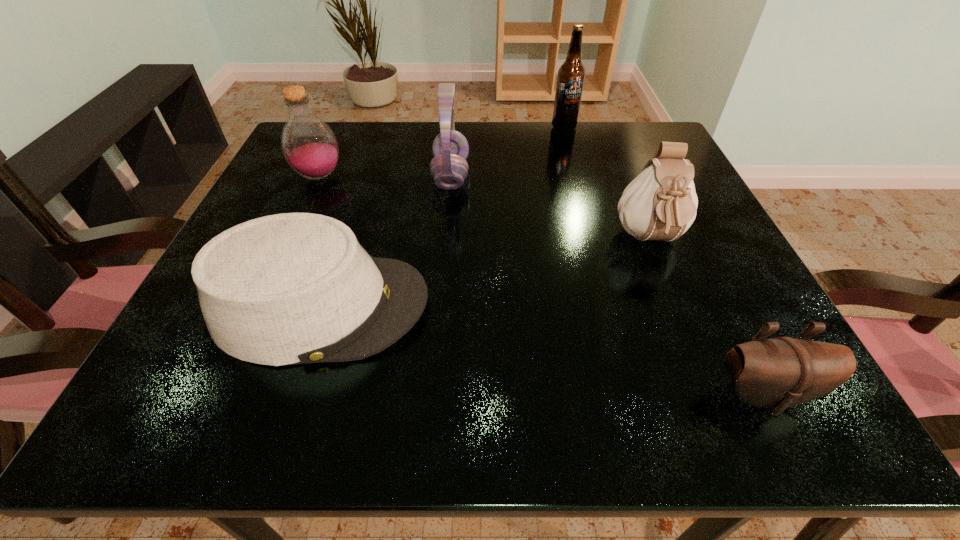
Where is `vacant region between the hat and the taller pouch`? vacant region between the hat and the taller pouch is located at coordinates (486, 273).

Find the location of `free space between the shorter pouch and the bottle`. free space between the shorter pouch and the bottle is located at coordinates (540, 285).

This screenshot has height=540, width=960. I want to click on vacant area that lies between the bottle and the taller pouch, so click(x=485, y=208).

The width and height of the screenshot is (960, 540). I want to click on vacant area between the nearer pouch and the headset, so click(607, 285).

This screenshot has width=960, height=540. Identify the location of vacant point located between the taller pouch and the headset. (550, 208).

I want to click on object identified as the closest to the shorter pouch, so click(x=660, y=203).

Locate an element on the screen. the third closest object relative to the nearest object is located at coordinates (449, 168).

What are the coordinates of `vacant point that satisfies the following two spatial constraints: 1. on the label of the beer bottle; 2. on the front-facing side of the hat` in the screenshot? It's located at (613, 306).

The image size is (960, 540). What are the coordinates of `blank area in the image that satisfies the following two spatial constraints: 1. on the label of the tallest object; 2. on the headband and ear cups of the headset` in the screenshot? It's located at (577, 176).

Image resolution: width=960 pixels, height=540 pixels. Identify the location of blank space that satisfies the following two spatial constraints: 1. on the label of the beer bottle; 2. on the headband and ear cups of the headset. (577, 176).